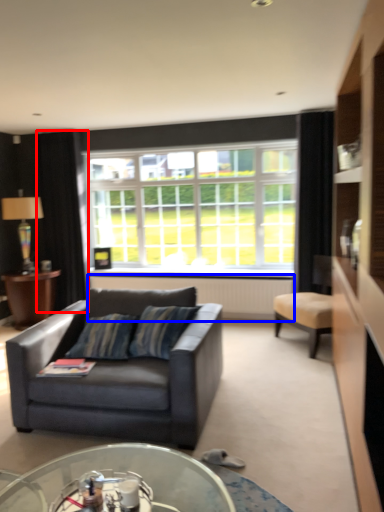
Question: Among these objects, which one is nearest to the camera, curtain (highlighted by a red box) or radiator (highlighted by a blue box)?

Choices:
 (A) curtain
 (B) radiator

Answer: (B)